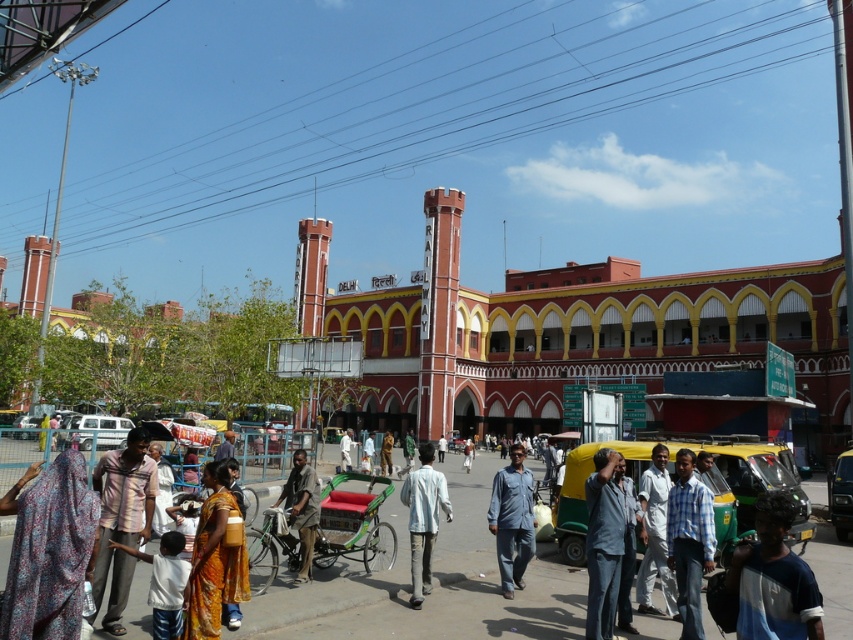
Which of these two, orange printed sari at center or dark brown fabric bicycle at center, stands shorter?

dark brown fabric bicycle at center

The height and width of the screenshot is (640, 853). What do you see at coordinates (213, 560) in the screenshot?
I see `orange printed sari at center` at bounding box center [213, 560].

The height and width of the screenshot is (640, 853). What do you see at coordinates (213, 560) in the screenshot? I see `orange printed sari at center` at bounding box center [213, 560].

Where is `orange printed sari at center`? The width and height of the screenshot is (853, 640). orange printed sari at center is located at coordinates (213, 560).

Who is positioned more to the left, light brown fabric at lower left or white cotton shirt at center?

From the viewer's perspective, light brown fabric at lower left appears more on the left side.

This screenshot has height=640, width=853. What do you see at coordinates (120, 518) in the screenshot?
I see `light brown fabric at lower left` at bounding box center [120, 518].

Looking at this image, who is more forward, (100, 456) or (660, 589)?

Point (660, 589) is more forward.

Identify the location of light brown fabric at lower left. This screenshot has width=853, height=640. (120, 518).

This screenshot has width=853, height=640. What do you see at coordinates (120, 518) in the screenshot? I see `light brown fabric at lower left` at bounding box center [120, 518].

The height and width of the screenshot is (640, 853). Identify the location of light brown fabric at lower left. (120, 518).

You are a GUI agent. You are given a task and a screenshot of the screen. Output one action in this format:
    pyautogui.click(x=<x>, y=<y>)
    Task: Click on the light brown fabric at lower left
    
    Given the screenshot: What is the action you would take?
    pyautogui.click(x=120, y=518)